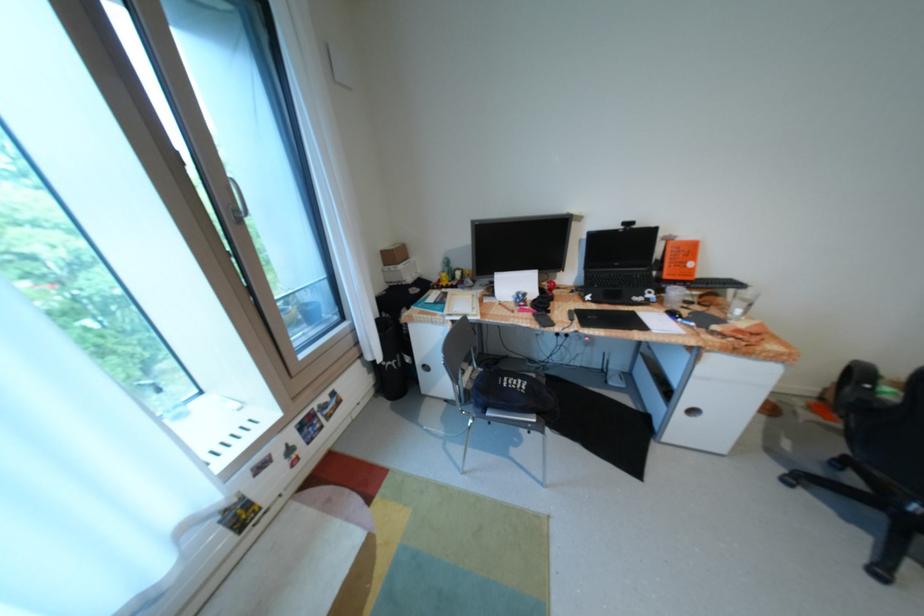
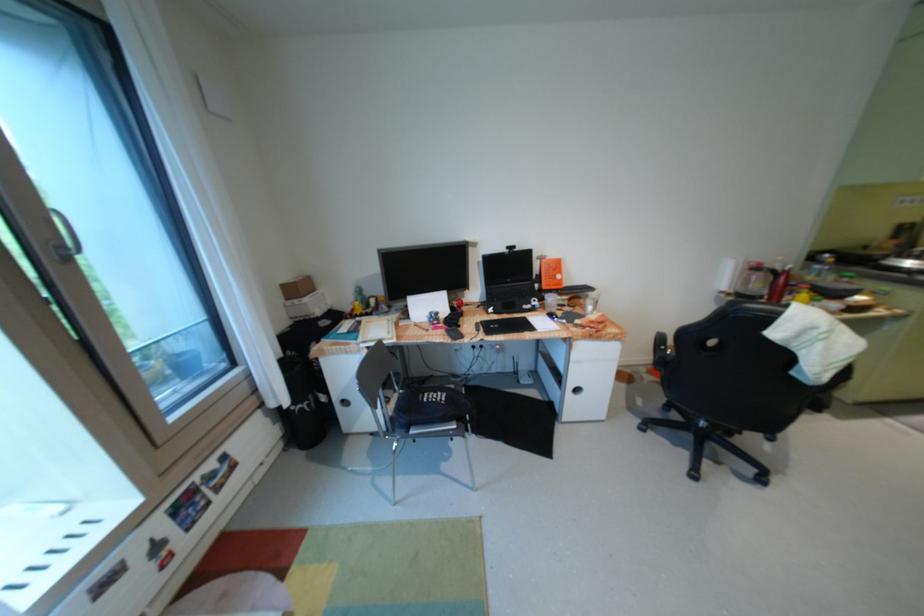
In the second image, find the point that corresponds to point 397,268 in the first image.

(300, 302)